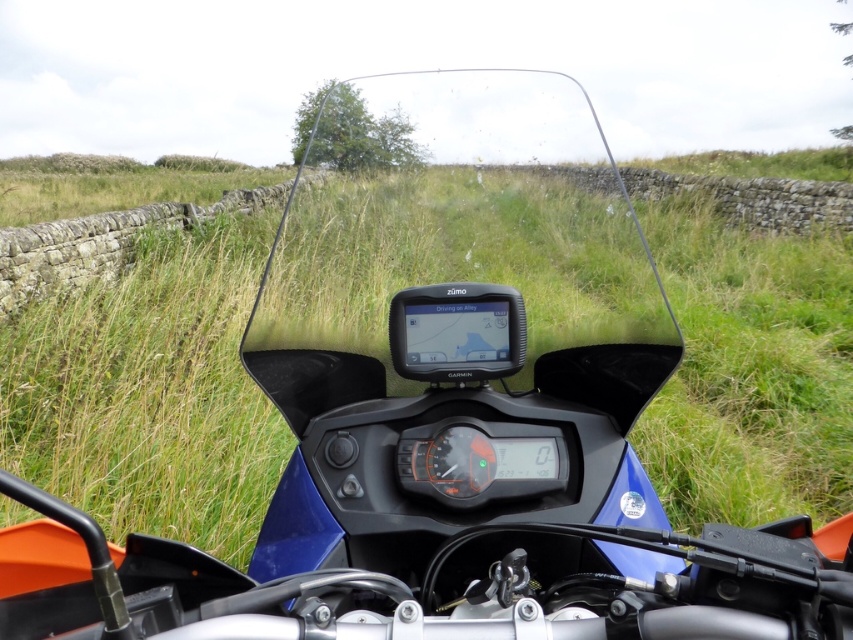
You are a rider checking the motorcycle dashboard. You notice the transparent plastic windshield at center and the matte black gps at center. Which object is bigger in size?

The transparent plastic windshield at center is larger in size compared to the matte black gps at center.

You are riding a motorcycle and looking at the dashboard. You see the green grassy at center and the matte black gps at center. Which object is closer to you?

The matte black gps at center is closer to you because the green grassy at center is in front of it, meaning the grass is further away.